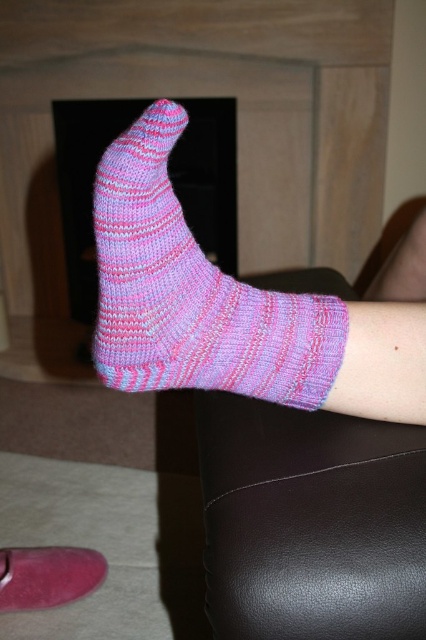
From the picture: You are organizing a sock display and need to arrange the pink knitted sock at center and the pink knitted sock at lower center based on their positions. Which sock should be placed to the left if you want to maintain the same spatial relationship as in the image?

The pink knitted sock at lower center should be placed to the left because in the image, the pink knitted sock at center is to the right of the pink knitted sock at lower center.

You are organizing a sock display and need to arrange the purple knitted sock at lower center and the pink knitted sock at lower center based on their positions in the image. Which sock should be placed higher on the display shelf?

The purple knitted sock at lower center should be placed higher on the display shelf because it is located above the pink knitted sock at lower center in the image.

You are a delivery robot standing near the fireplace. You need to place a package on the pink knitted sock at center or the pink knitted sock at lower center. Which sock is closer to you?

The pink knitted sock at lower center is closer to you since it is only 27.95 inches away from the pink knitted sock at center, but since the robot is near the fireplace, the distance from the robot to each sock would depend on their positions relative to the fireplace. However, based on the given information, the pink knitted sock at lower center is positioned closer to the robot than the pink knitted sock at center.